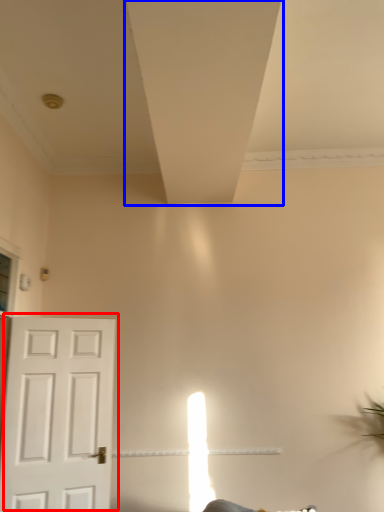
Question: Which object appears farthest to the camera in this image, door (highlighted by a red box) or exhaust hood (highlighted by a blue box)?

Choices:
 (A) door
 (B) exhaust hood

Answer: (A)